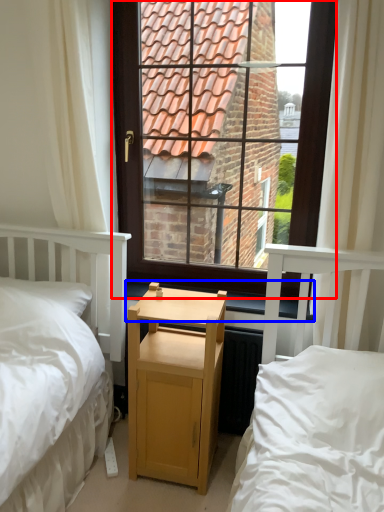
Question: Which object is further to the camera taking this photo, window (highlighted by a red box) or window sill (highlighted by a blue box)?

Choices:
 (A) window
 (B) window sill

Answer: (B)